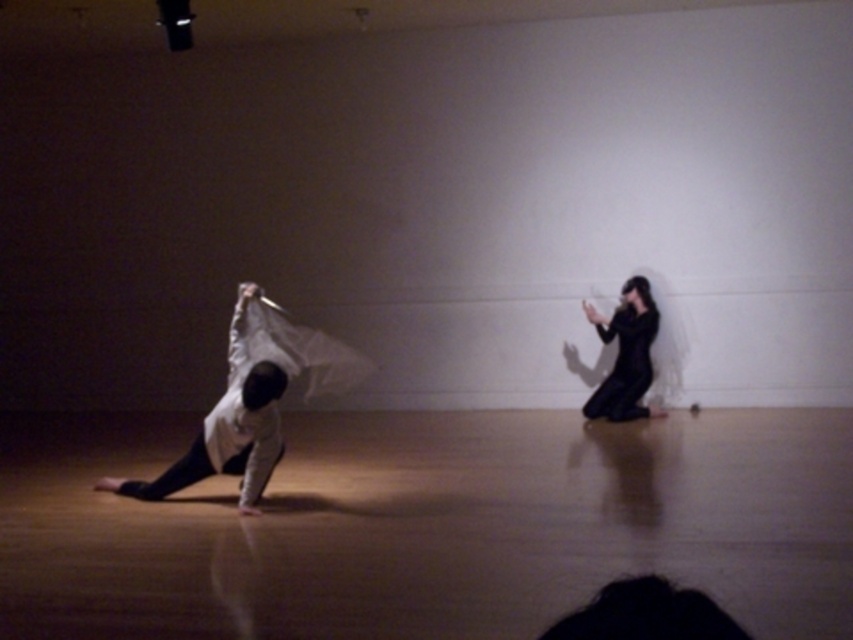
You are an art curator planning an exhibition layout. You need to place a spotlight that will illuminate both the white matte fabric at left and the black matte dress at right without overlapping their shadows. Given their current positions, where should you position the spotlight to achieve this?

The white matte fabric at left is in front of the black matte dress at right. To prevent shadow overlap, position the spotlight behind the black matte dress at right, casting its shadow away from the white matte fabric at left.

You are an art curator planning to install a motion sensor that triggers lighting effects when someone approaches the white matte fabric at left. The sensor has a 1.5 meter detection radius. If you stand at the center of the room, which is at point coordinates of 0.5, 0.5, will the sensor detect your presence?

The white matte fabric at left is located at point coordinates of (252, 401). The distance between the center of the room at (426, 320) and the fabric is approximately 0.26 meters, which is well within the 1.5 meter detection radius. Therefore, the sensor will detect your presence.

You are a photographer setting up a shoot in the gallery. You need to position a spotlight so that it illuminates both the white matte fabric at left and the black matte dress at right without causing glare. Considering their heights, which object should be placed closer to the spotlight to ensure even lighting?

The white matte fabric at left is taller than the black matte dress at right. To achieve even lighting, the black matte dress at right should be placed closer to the spotlight since it is shorter, allowing the light to reach it effectively while the taller fabric can be positioned slightly farther away to balance the illumination.